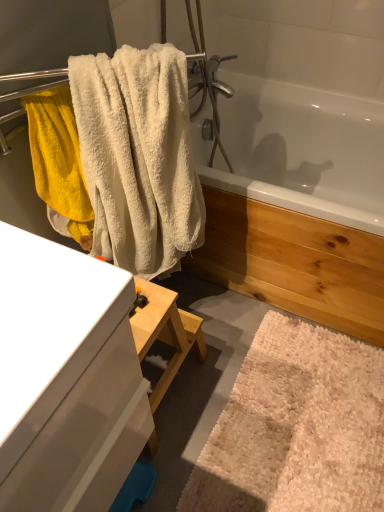
Find the location of a particular element. This screenshot has height=512, width=384. vacant point above white fluffy bath mat at lower right (from a real-world perspective) is located at coordinates (307, 418).